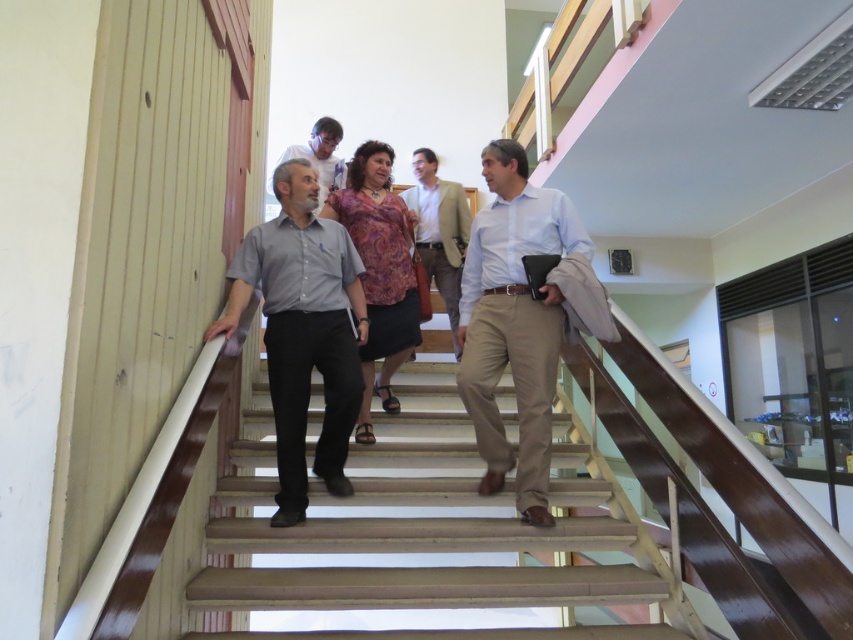
Which is below, purple floral blouse at center or light brown textured blazer at center?

purple floral blouse at center is below.

Which is more to the left, purple floral blouse at center or light brown textured blazer at center?

From the viewer's perspective, purple floral blouse at center appears more on the left side.

Which is behind, point (393, 312) or point (444, 234)?

The point (444, 234) is more distant.

Locate an element on the screen. The height and width of the screenshot is (640, 853). purple floral blouse at center is located at coordinates (379, 272).

Does wooden stairs at center lie behind light brown textured blazer at center?

No, wooden stairs at center is in front of light brown textured blazer at center.

What do you see at coordinates (426, 541) in the screenshot? I see `wooden stairs at center` at bounding box center [426, 541].

Locate an element on the screen. wooden stairs at center is located at coordinates (426, 541).

I want to click on wooden stairs at center, so pyautogui.click(x=426, y=541).

Who is positioned more to the right, wooden stairs at center or light blue shirt at center?

From the viewer's perspective, light blue shirt at center appears more on the right side.

The width and height of the screenshot is (853, 640). I want to click on wooden stairs at center, so click(x=426, y=541).

The image size is (853, 640). I want to click on wooden stairs at center, so click(x=426, y=541).